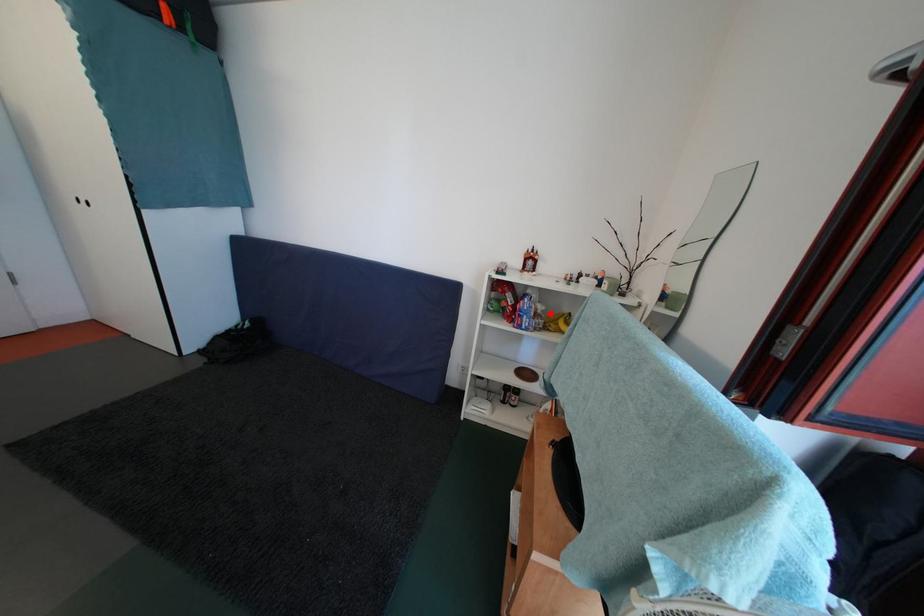
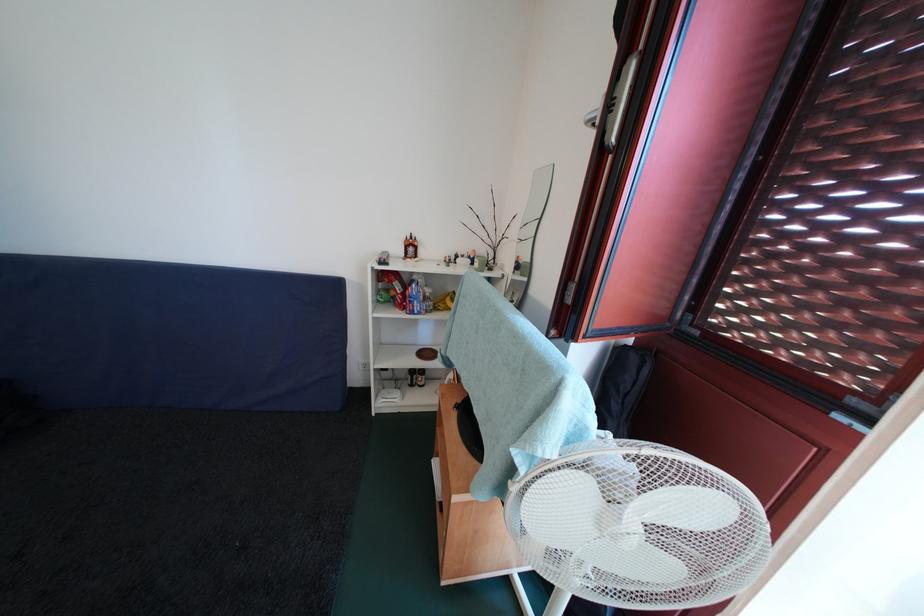
In the second image, find the point that corresponds to the highlighted location in the first image.

(438, 296)